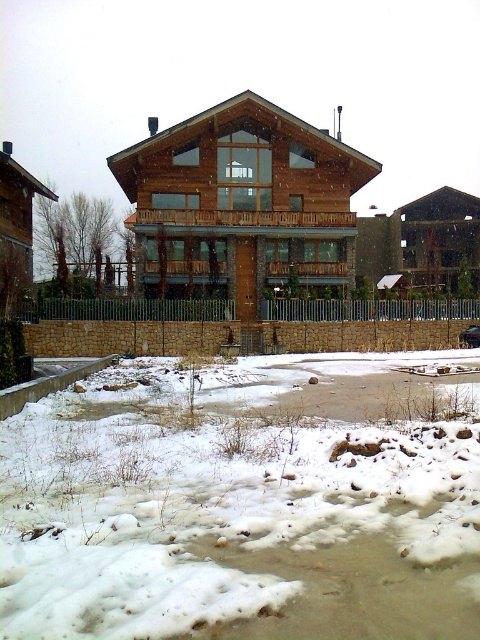
You are standing in front of the two story wooden house and looking at the stone wall in front of it. There is a point marked at coordinate (x=240, y=508). What is located at this point?

The point at coordinate (x=240, y=508) corresponds to white fluffy snow at lower center.

You are standing in front of the house and want to park your shiny black car at center. There is white fluffy snow at lower center. Which direction should you move the car to avoid the snow?

The white fluffy snow at lower center is to the left of the shiny black car at center. To avoid the snow, move the car to the right.